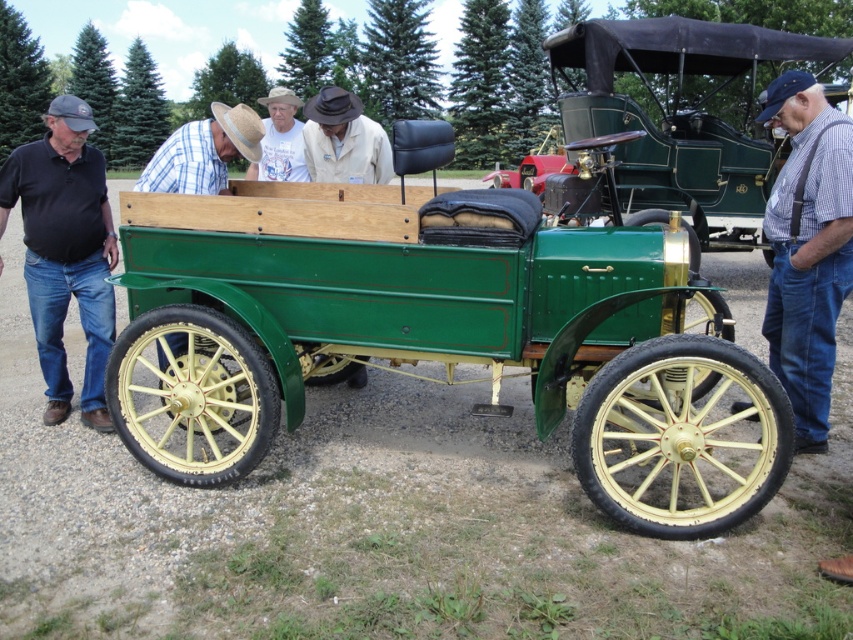
Describe the element at coordinates (807, 248) in the screenshot. The image size is (853, 640). I see `blue plaid shirt at right` at that location.

Can you confirm if blue plaid shirt at right is shorter than white cotton shirt at center?

Correct, blue plaid shirt at right is not as tall as white cotton shirt at center.

From the picture: Who is more distant from viewer, (795, 324) or (293, 179)?

Point (293, 179)

Identify the location of blue plaid shirt at right. The width and height of the screenshot is (853, 640). (807, 248).

Can you confirm if plaid shirt at center is shorter than white cotton shirt at center?

Yes.

Find the location of a particular element. plaid shirt at center is located at coordinates (202, 152).

Does blue plaid shirt at right have a lesser width compared to black cotton shirt at left?

In fact, blue plaid shirt at right might be wider than black cotton shirt at left.

Who is more distant from viewer, (815, 125) or (102, 420)?

Positioned behind is point (102, 420).

Which is behind, point (813, 228) or point (9, 170)?

The point (9, 170) is more distant.

Locate an element on the screen. The height and width of the screenshot is (640, 853). blue plaid shirt at right is located at coordinates (807, 248).